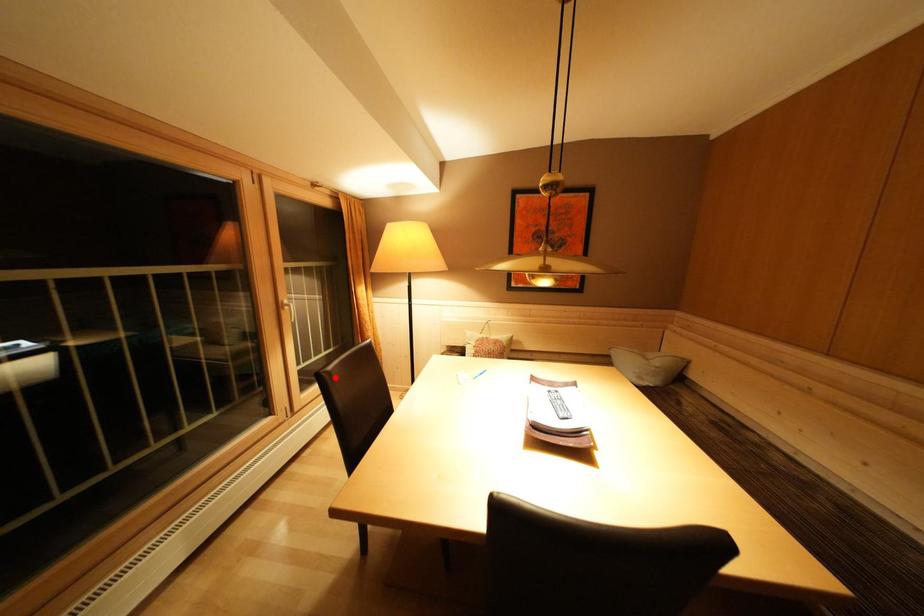
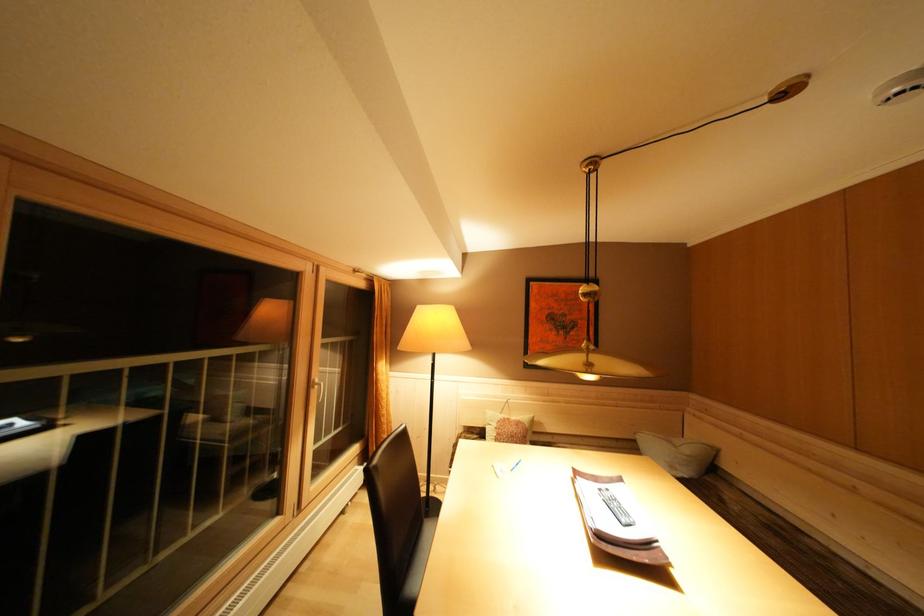
Question: I am providing you with two images of the same scene from different viewpoints. A red point is marked on the first image. Is the red point's position out of view in image 2?

Choices:
 (A) Yes
 (B) No

Answer: (B)